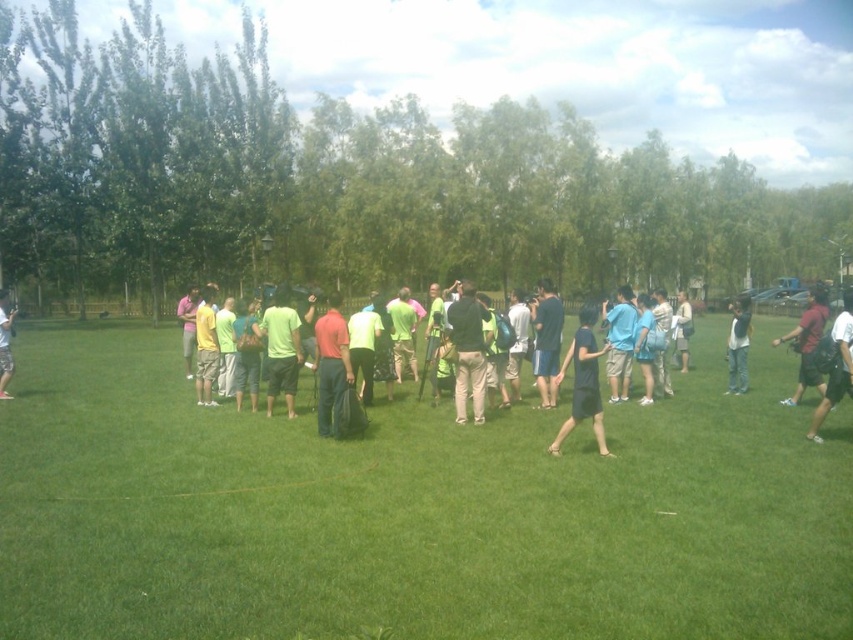
Question: Among these points, which one is nearest to the camera?

Choices:
 (A) (538, 371)
 (B) (827, 372)

Answer: (B)

Question: Which object is the farthest from the dark blue shirt at right?

Choices:
 (A) green matte shirt at center
 (B) green fabric shirt at center

Answer: (B)

Question: Considering the relative positions of dark blue t-shirt at center and blue fabric shirt at center in the image provided, where is dark blue t-shirt at center located with respect to blue fabric shirt at center?

Choices:
 (A) left
 (B) right

Answer: (A)

Question: Which object is closer to the camera taking this photo?

Choices:
 (A) green matte shirt at center
 (B) blue fabric shirt at center

Answer: (A)

Question: Does dark red shirt at right have a lesser width compared to light blue shirt at center?

Choices:
 (A) no
 (B) yes

Answer: (A)

Question: Does dark blue fabric shirt at center have a lesser width compared to jeans at right?

Choices:
 (A) no
 (B) yes

Answer: (B)